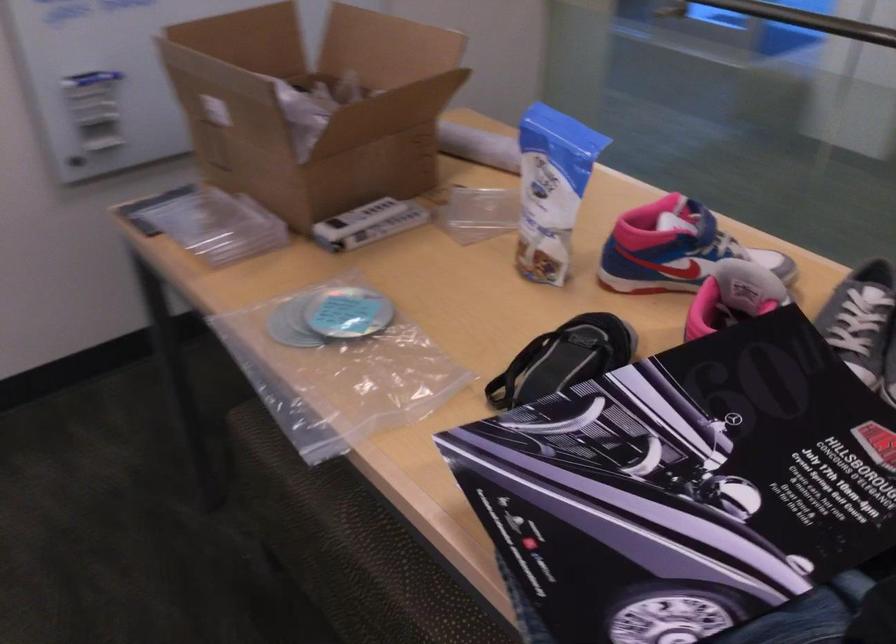
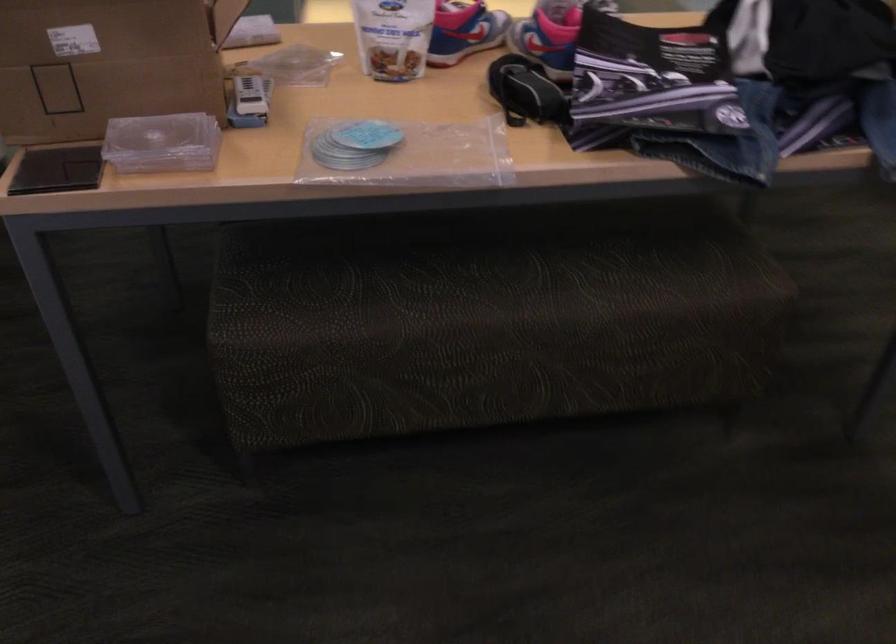
Where in the second image is the point corresponding to (543,373) from the first image?

(524, 91)